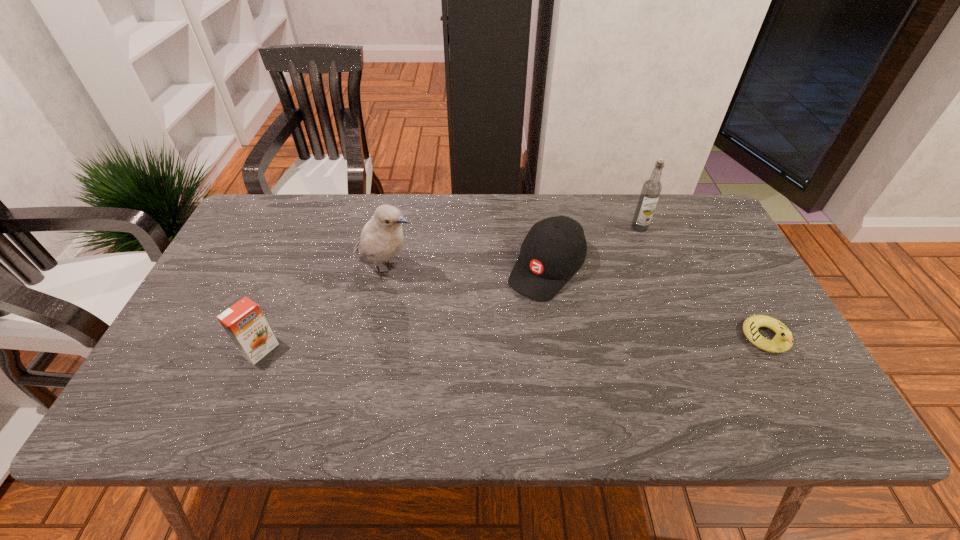
Locate an element on the screen. the leftmost object is located at coordinates (244, 322).

Where is `the shortest object`? This screenshot has width=960, height=540. the shortest object is located at coordinates (783, 340).

Where is `duckling`? duckling is located at coordinates (783, 340).

Where is `the farthest object`? The image size is (960, 540). the farthest object is located at coordinates (651, 189).

Where is `vodka`? The image size is (960, 540). vodka is located at coordinates (651, 189).

Where is `the third object from right to left`? the third object from right to left is located at coordinates point(555,248).

Find the location of a particular element. the fourth object from right to left is located at coordinates (382, 238).

The width and height of the screenshot is (960, 540). I want to click on vacant space located on the back of the orange juice, so click(x=303, y=247).

Identify the location of vacant space located 0.050m on the face of the duckling. (788, 378).

Identify the location of free space located on the label of the farthest object. This screenshot has height=540, width=960. (594, 282).